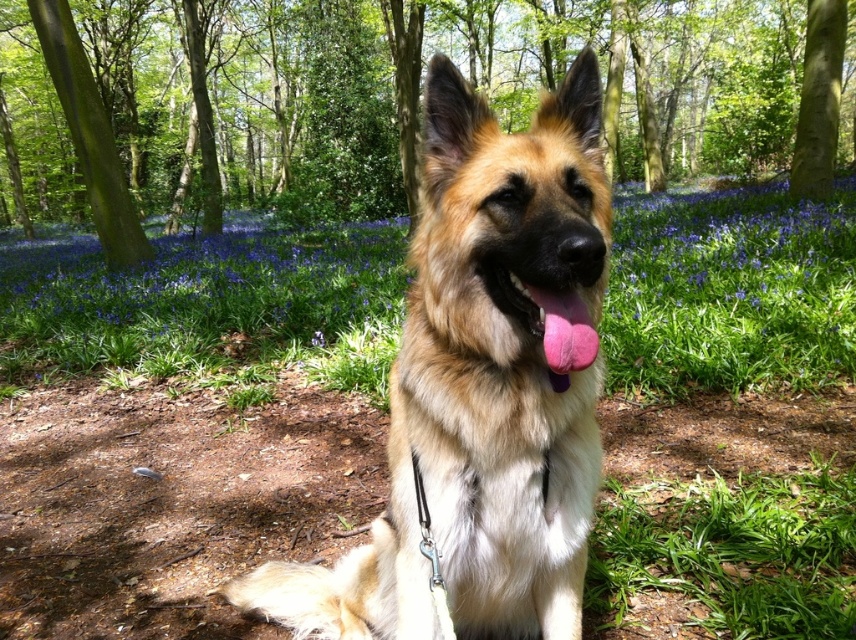
Question: Among these points, which one is nearest to the camera?

Choices:
 (A) (437, 428)
 (B) (46, 54)
 (C) (835, 83)
 (D) (100, 236)

Answer: (A)

Question: Does green leafy tree at center have a lesser width compared to green rough bark tree at upper left?

Choices:
 (A) yes
 (B) no

Answer: (B)

Question: Is green leafy tree at center to the left of smooth bark tree at upper right from the viewer's perspective?

Choices:
 (A) yes
 (B) no

Answer: (A)

Question: Which point is closer to the camera?

Choices:
 (A) golden fur dog at center
 (B) green leafy tree at center

Answer: (A)

Question: Is golden fur dog at center wider than green rough bark tree at upper left?

Choices:
 (A) yes
 (B) no

Answer: (B)

Question: Considering the real-world distances, which object is farthest from the green rough bark tree at upper left?

Choices:
 (A) green leafy tree at center
 (B) golden fur dog at center

Answer: (A)